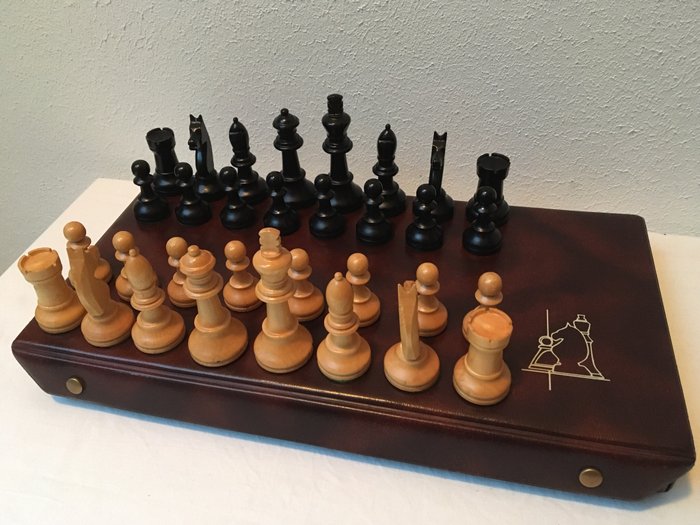
At what (x,y) coordinates should I click in order to perform the action: click on picture on case. Please return your answer as a coordinate pair (x, y). The image size is (700, 525). Looking at the image, I should click on (577, 360).